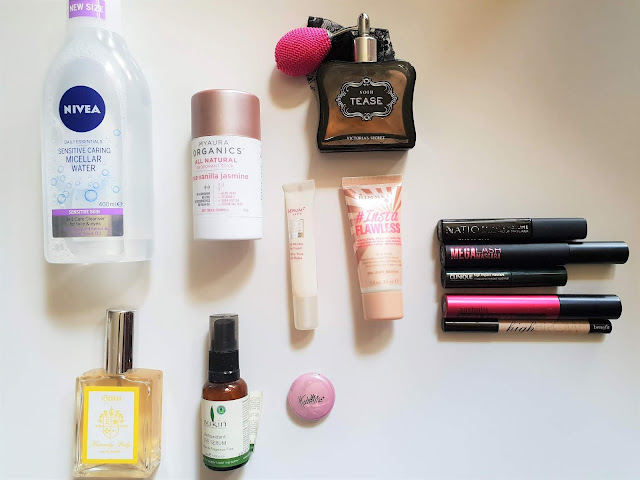
This screenshot has width=640, height=480. What are the coordinates of `perfume` in the screenshot? It's located at pos(390,62), pos(387,117).